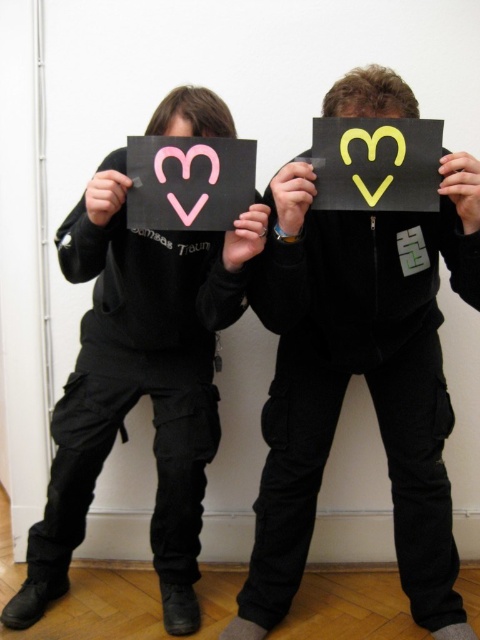
You are a photographer standing 1.5 meters away from the plain white wall. You want to take a photo of the pink matte heart at center. Can you reach it with your hand to adjust its position without moving closer than 1.5 meters?

The pink matte heart at center and viewer are 1.26 meters apart from each other. Since you are standing 1.5 meters away from the wall, the distance between you and the pink matte heart at center is 1.5 meters minus the distance from the wall to the heart. However, the given information states the heart is 1.26 meters from the viewer, which already accounts for your position. Therefore, you are 1.26 meters away from the heart. To adjust it without moving closer than 1.5 meters, you need to stay at least 1.5m

You are a photographer adjusting the lighting for a photo shoot. You need to ensure that both the yellow matte heart at center and the pink matte heart at upper left are evenly lit. Which heart should you focus your light on first to account for their positions?

The yellow matte heart at center is closer to the viewer than the pink matte heart at upper left, so you should focus the light on the pink matte heart at upper left first to ensure it receives enough illumination since it is farther away and might be in shadow.